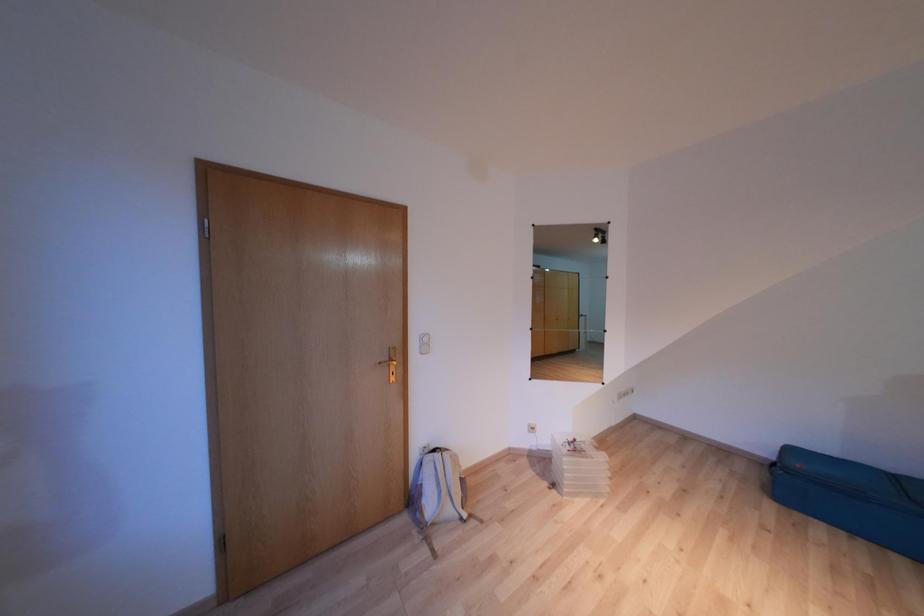
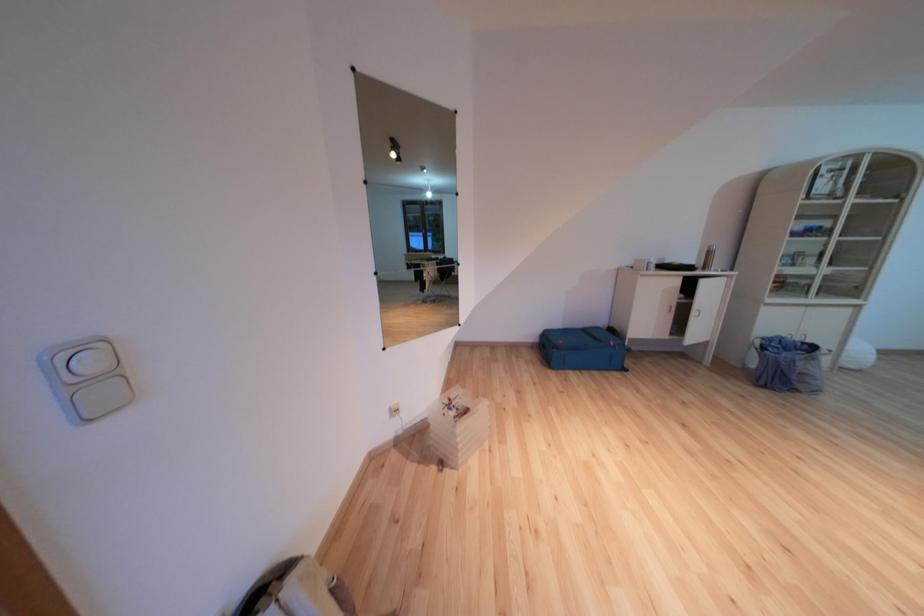
Question: The camera is either moving clockwise (left) or counter-clockwise (right) around the object. The first image is from the beginning of the video and the second image is from the end. Is the camera moving left or right when shooting the video?

Choices:
 (A) Left
 (B) Right

Answer: (A)